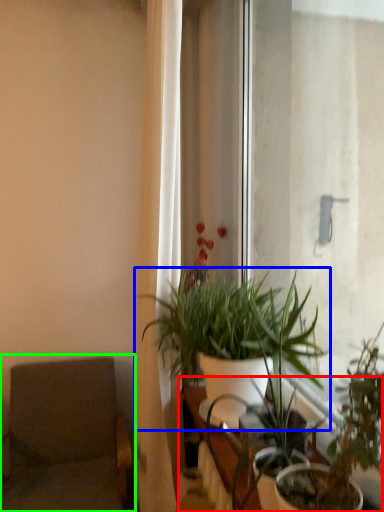
Question: Estimate the real-world distances between objects in this image. Which object is farther from table (highlighted by a red box), houseplant (highlighted by a blue box) or swivel chair (highlighted by a green box)?

Choices:
 (A) houseplant
 (B) swivel chair

Answer: (B)